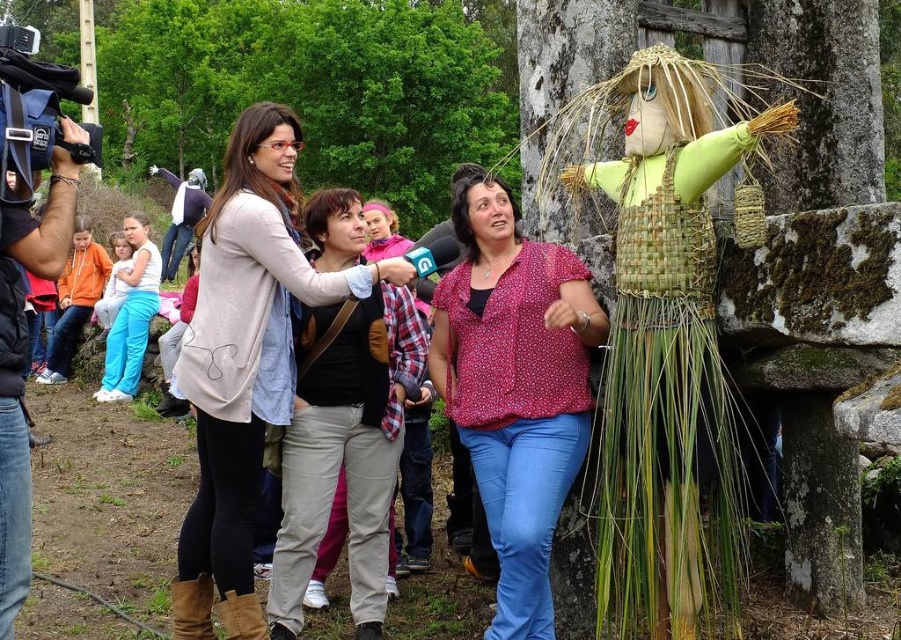
What is located at the point with coordinates (246, 360) in the image?

The point with coordinates (246, 360) is on the matte beige sweater at center.

You are a photographer at the event and want to capture both the matte beige sweater at center and the floral blouse at center in the same frame. Which one should you focus on first to ensure both are in focus?

The matte beige sweater at center is above the floral blouse at center, so focusing on the matte beige sweater at center first will ensure both are in focus as they are stacked vertically.

Looking at the two central items in the scene, the matte beige sweater at center and the floral blouse at center, which one is positioned to the left?

The matte beige sweater at center is to the left of the floral blouse at center.